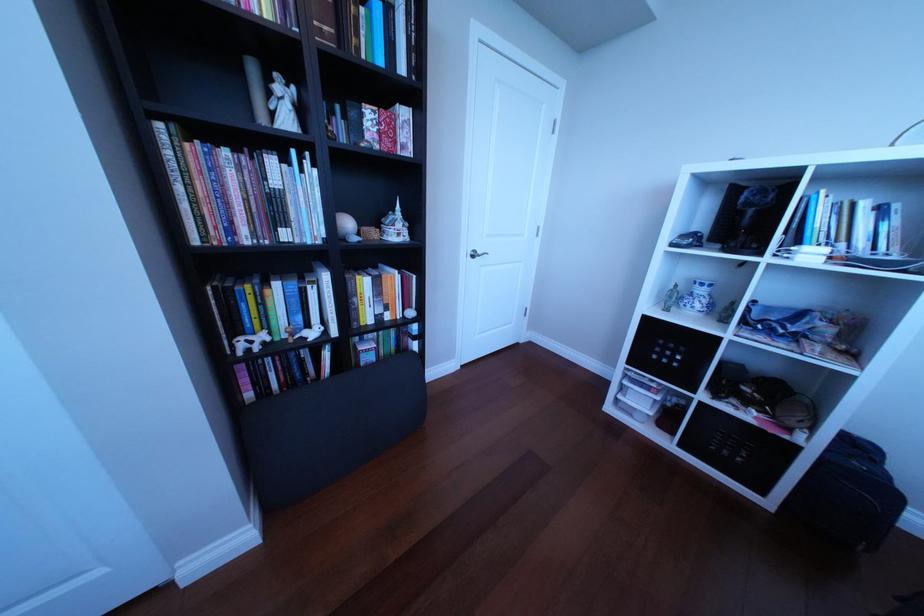
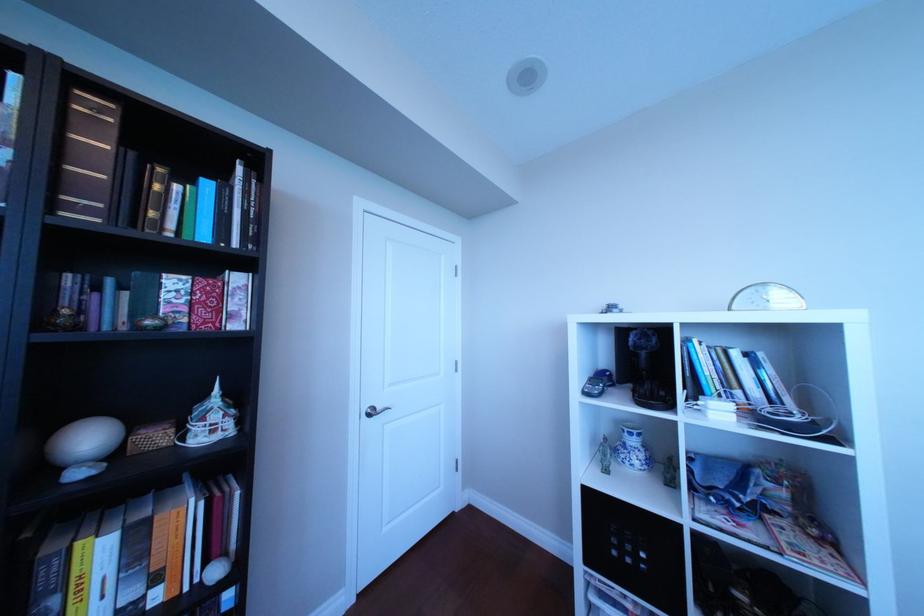
In a continuous first-person perspective shot, in which direction is the camera moving?

The cameraman moved toward right, forward.